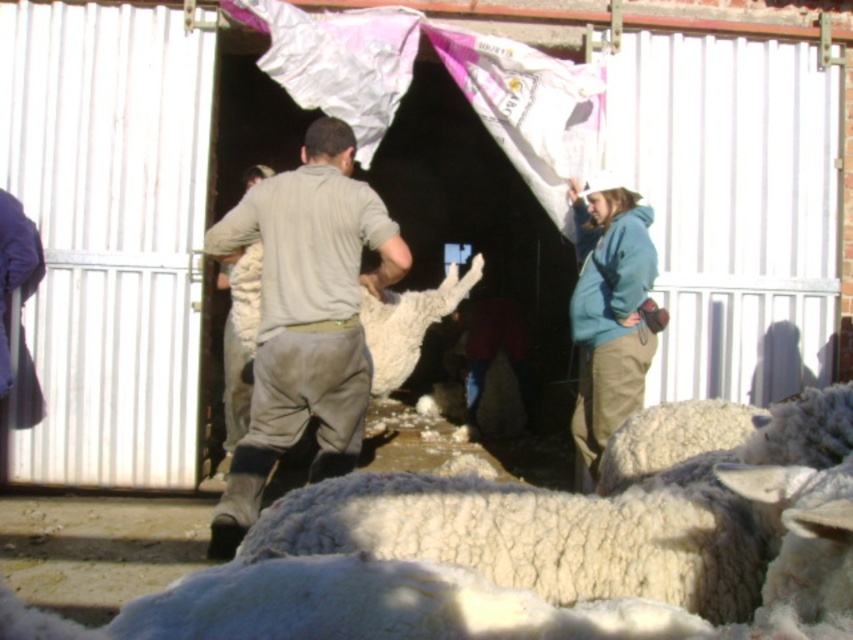
What do you see at coordinates (305, 316) in the screenshot? Image resolution: width=853 pixels, height=640 pixels. I see `gray cotton shirt at center` at bounding box center [305, 316].

Does point (335, 285) come closer to viewer compared to point (368, 296)?

That is True.

Between point (270, 333) and point (386, 346), which one is positioned in front?

Point (270, 333) is more forward.

You are a GUI agent. You are given a task and a screenshot of the screen. Output one action in this format:
    pyautogui.click(x=<x>, y=<y>)
    Task: Click on the gray cotton shirt at center
    Image resolution: width=853 pixels, height=640 pixels.
    Given the screenshot: What is the action you would take?
    pyautogui.click(x=305, y=316)

Does point (834, 467) come in front of point (345, 406)?

That is True.

Find the location of a particular element. This screenshot has height=640, width=853. white woolen sheep at center is located at coordinates (527, 556).

Is white woolen sheep at center to the left of white fluffy wool at center from the viewer's perspective?

Incorrect, white woolen sheep at center is not on the left side of white fluffy wool at center.

The width and height of the screenshot is (853, 640). Find the location of `white woolen sheep at center`. white woolen sheep at center is located at coordinates click(x=527, y=556).

The image size is (853, 640). In order to click on white woolen sheep at center in this screenshot , I will do `click(527, 556)`.

I want to click on white woolen sheep at center, so click(x=527, y=556).